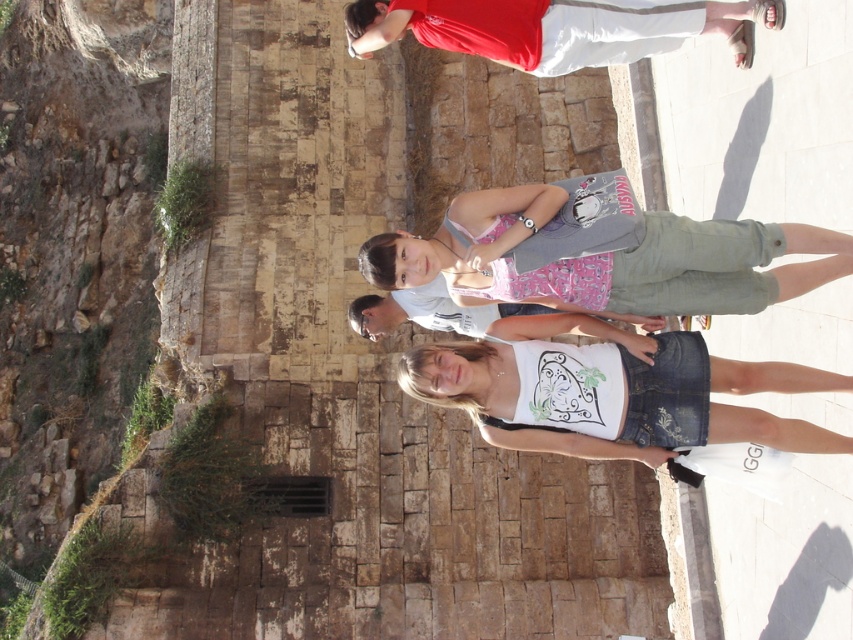
You are a photographer trying to capture a group photo. You notice the white cotton tank top at center and the red cotton shirt at upper center. Which clothing item should you adjust to ensure both are visible in the frame?

The white cotton tank top at center is to the right of the red cotton shirt at upper center. To ensure both are visible, you should adjust the red cotton shirt at upper center to move it slightly to the left or the white cotton tank top at center to the right, depending on the desired composition.

You are a photographer trying to capture a clear shot of both the white cotton tank top at center and the matte pink tank top at center. Since you want both subjects to be in focus, which tank top should you adjust your camera focus on first to ensure the closest one is properly captured?

The white cotton tank top at center is closer to the viewer than the matte pink tank top at center, so you should focus on the white cotton tank top at center first to ensure proper depth of field for both subjects.

You are a photographer adjusting the camera focus. You need to focus on the smaller of the two tank tops at the center. Which one should you choose between the white cotton tank top at center and the matte pink tank top at center?

The white cotton tank top at center has a smaller size compared to the matte pink tank top at center, so you should focus on the white cotton tank top at center.